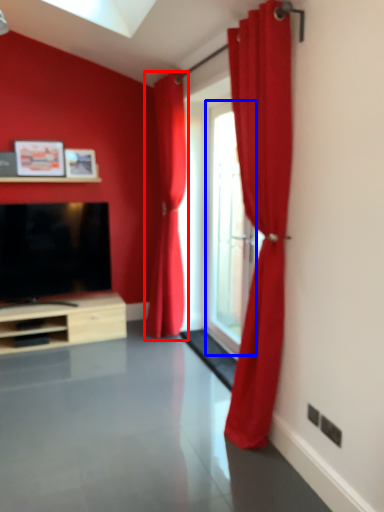
Question: Which of the following is the closest to the observer, curtain (highlighted by a red box) or window (highlighted by a blue box)?

Choices:
 (A) curtain
 (B) window

Answer: (B)